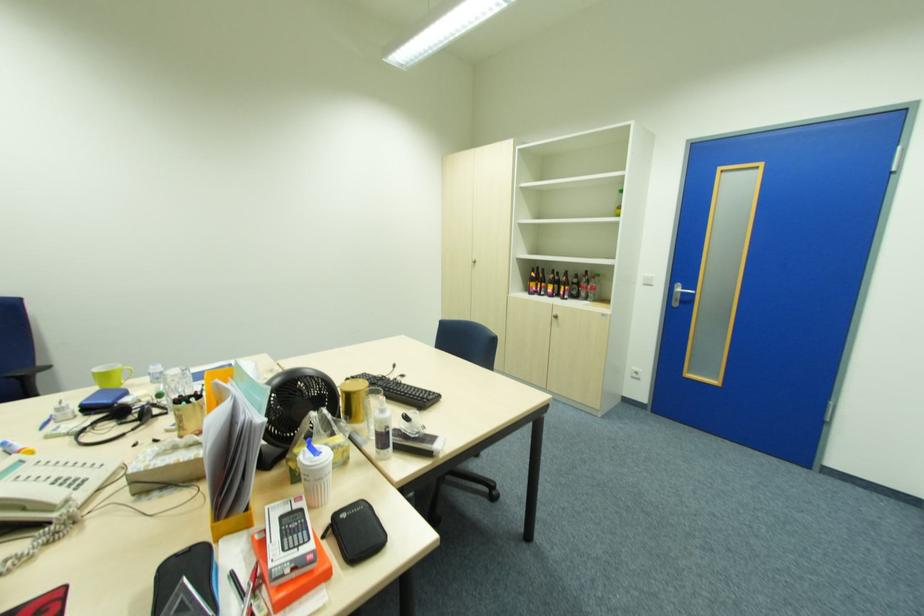
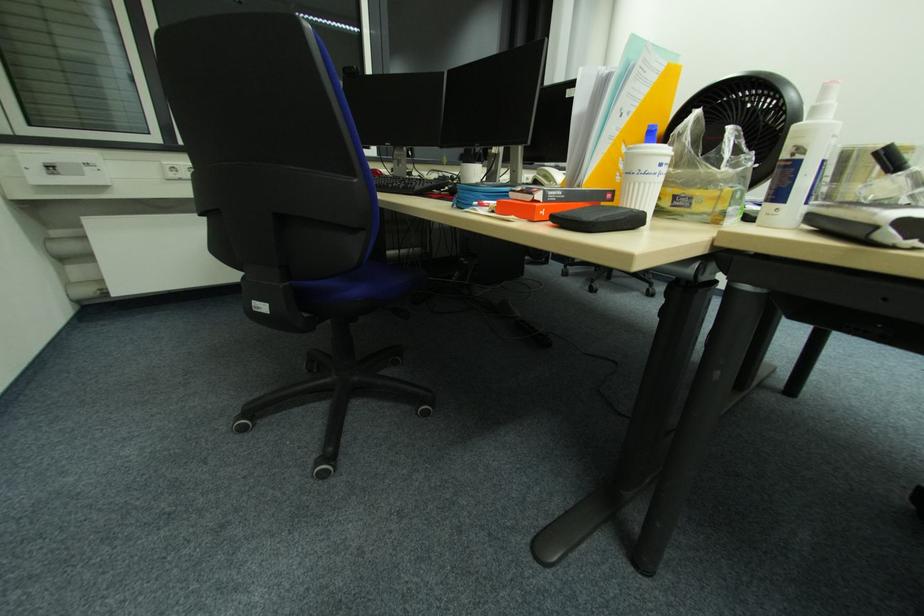
The images are taken continuously from a first-person perspective. In which direction is your viewpoint rotating?

The camera's rotation is toward left-down.